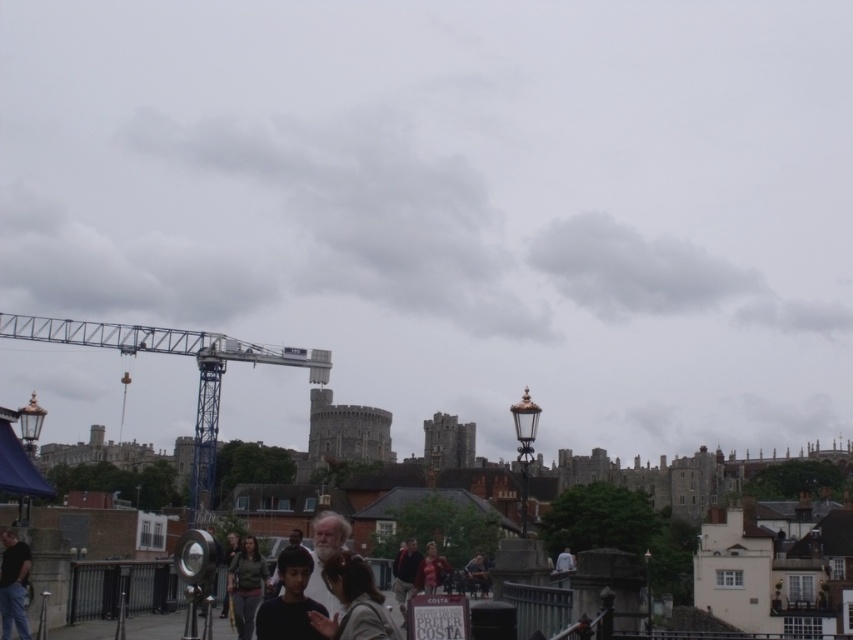
Is light brown hair at center closer to camera compared to smooth black shirt at center?

No, it is not.

Between light brown hair at center and smooth black shirt at center, which one has less height?

light brown hair at center

Describe the element at coordinates (352, 602) in the screenshot. I see `light brown hair at center` at that location.

Locate an element on the screen. The height and width of the screenshot is (640, 853). light brown hair at center is located at coordinates (352, 602).

Is dark blue jacket at center to the right of matte red dress at center from the viewer's perspective?

Incorrect, dark blue jacket at center is not on the right side of matte red dress at center.

Which of these two, dark blue jacket at center or matte red dress at center, stands shorter?

Standing shorter between the two is matte red dress at center.

What are the coordinates of `dark blue jacket at center` in the screenshot? It's located at (405, 572).

Can you confirm if dark gray shirt at lower left is positioned below dark blue jacket at center?

Actually, dark gray shirt at lower left is above dark blue jacket at center.

Is point (15, 536) positioned after point (412, 568)?

No, (15, 536) is closer to viewer.

Locate an element on the screen. The image size is (853, 640). dark gray shirt at lower left is located at coordinates (13, 584).